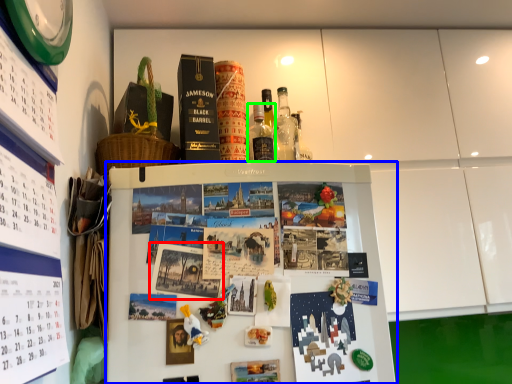
Question: Estimate the real-world distances between objects in this image. Which object is farther from book cover (highlighted by a red box), refrigerator (highlighted by a blue box) or bottle (highlighted by a green box)?

Choices:
 (A) refrigerator
 (B) bottle

Answer: (B)